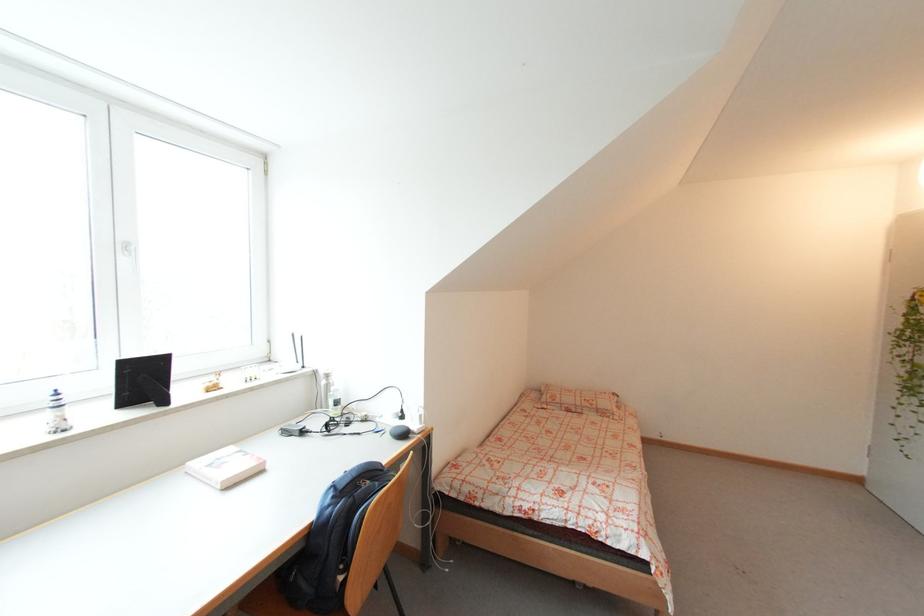
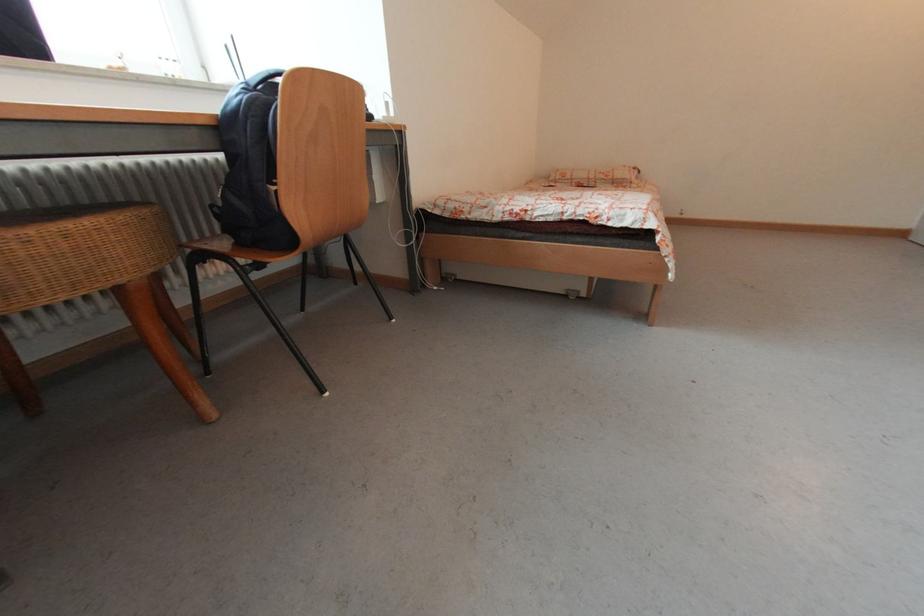
In a continuous first-person perspective shot, in which direction is the camera moving?

The cameraman moved toward right, forward.